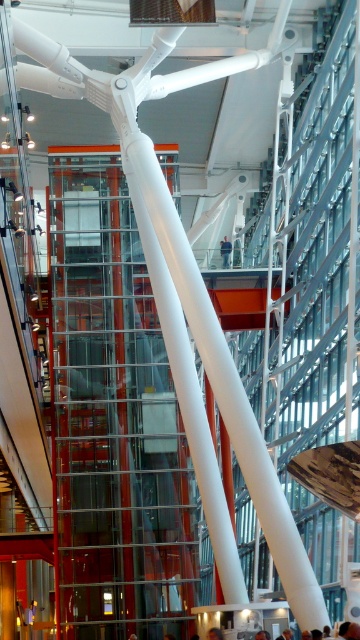
In the scene shown: Which is more to the left, blue denim jacket at center or orange fabric person at center?

blue denim jacket at center

Consider the image. Does blue denim jacket at center appear over orange fabric person at center?

Yes.

Between point (227, 237) and point (259, 637), which one is positioned behind?

Point (227, 237)

I want to click on blue denim jacket at center, so click(225, 252).

Which is more to the left, blue denim jacket at center or brown hair at center?

brown hair at center is more to the left.

Is point (222, 262) less distant than point (167, 637)?

No, (222, 262) is behind (167, 637).

Who is more distant from viewer, (x=228, y=262) or (x=172, y=636)?

Positioned behind is point (x=228, y=262).

Where is `blue denim jacket at center`? This screenshot has width=360, height=640. blue denim jacket at center is located at coordinates (225, 252).

Measure the distance from orange fabric person at center to brown hair at center.

orange fabric person at center and brown hair at center are 7.23 meters apart.

Does orange fabric person at center have a lesser height compared to brown hair at center?

Yes.

Does point (259, 634) come farther from viewer compared to point (173, 636)?

No.

Find the location of `orange fabric person at center`. orange fabric person at center is located at coordinates (262, 634).